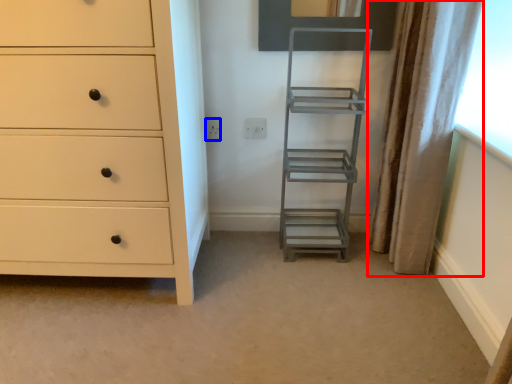
Question: Which object is closer to the camera taking this photo, curtain (highlighted by a red box) or electric outlet (highlighted by a blue box)?

Choices:
 (A) curtain
 (B) electric outlet

Answer: (A)